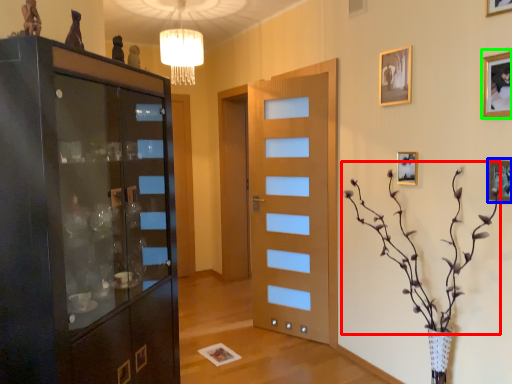
Question: Considering the real-world distances, which object is farthest from floral arrangement (highlighted by a red box)? picture frame (highlighted by a blue box) or picture frame (highlighted by a green box)?

Choices:
 (A) picture frame
 (B) picture frame

Answer: (B)